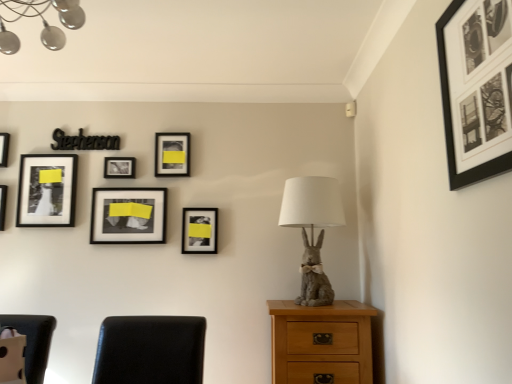
Where is `metallic glass chandelier at upper left`? Image resolution: width=512 pixels, height=384 pixels. metallic glass chandelier at upper left is located at coordinates (42, 22).

Measure the distance between matte black picture frame at upper left, which is the 6th picture frame from front to back, and camera.

matte black picture frame at upper left, which is the 6th picture frame from front to back, and camera are 8.21 feet apart from each other.

I want to click on matte black picture frame at upper left, the fifth picture frame viewed from the right, so click(x=119, y=167).

The height and width of the screenshot is (384, 512). Describe the element at coordinates (321, 342) in the screenshot. I see `light oak wooden chest of drawers at lower right` at that location.

What do you see at coordinates (3, 205) in the screenshot? I see `matte black picture frame at left, which ranks as the 7th picture frame in right-to-left order` at bounding box center [3, 205].

Describe the element at coordinates (475, 91) in the screenshot. I see `black matte picture frame at upper right, the first picture frame from the front` at that location.

Identify the location of metallic glass chandelier at upper left. (x=42, y=22).

Between matte black frame at upper left, which is the 5th picture frame in front-to-back order, and matte black picture frame at upper left, the eighth picture frame from the front, which one has larger width?

matte black frame at upper left, which is the 5th picture frame in front-to-back order, is wider.

From the image's perspective, is matte black frame at upper left, positioned as the fourth picture frame in back-to-front order, positioned above or below matte black picture frame at upper left, marked as the first picture frame in a left-to-right arrangement?

Based on their image positions, matte black frame at upper left, positioned as the fourth picture frame in back-to-front order, is located beneath matte black picture frame at upper left, marked as the first picture frame in a left-to-right arrangement.

From a real-world perspective, is matte black frame at upper left, the sixth picture frame in the right-to-left sequence, located beneath matte black picture frame at upper left, marked as the first picture frame in a left-to-right arrangement?

Yes, from a real-world perspective, matte black frame at upper left, the sixth picture frame in the right-to-left sequence, is under matte black picture frame at upper left, marked as the first picture frame in a left-to-right arrangement.

Is matte black frame at upper left, the 3th picture frame when ordered from left to right, directly adjacent to matte black picture frame at upper left, which appears as the first picture frame when viewed from the back?

They are not placed beside each other.

Is matte black picture frame at center, the sixth picture frame when ordered from back to front, oriented towards black matte picture frame at upper right, which ranks as the first picture frame in right-to-left order?

No.

From the picture: Is there a large distance between matte black picture frame at center, which is counted as the 4th picture frame, starting from the right, and black matte picture frame at upper right, the first picture frame from the front?

Yes, matte black picture frame at center, which is counted as the 4th picture frame, starting from the right, and black matte picture frame at upper right, the first picture frame from the front, are quite far apart.

Is matte black picture frame at center, the sixth picture frame when ordered from back to front, positioned behind black matte picture frame at upper right, the first picture frame from the front?

Yes, the depth of matte black picture frame at center, the sixth picture frame when ordered from back to front, is greater than that of black matte picture frame at upper right, the first picture frame from the front.

There is a light oak wooden chest of drawers at lower right. Where is `the 6th picture frame above it (from a real-world perspective)`? The height and width of the screenshot is (384, 512). the 6th picture frame above it (from a real-world perspective) is located at coordinates [x=119, y=167].

Considering the relative positions of matte black picture frame at upper left, which is counted as the fourth picture frame, starting from the left, and light oak wooden chest of drawers at lower right in the image provided, is matte black picture frame at upper left, which is counted as the fourth picture frame, starting from the left, to the left or to the right of light oak wooden chest of drawers at lower right?

Based on their positions, matte black picture frame at upper left, which is counted as the fourth picture frame, starting from the left, is located to the left of light oak wooden chest of drawers at lower right.

From the image's perspective, which is above, matte black picture frame at upper left, which is the 6th picture frame from front to back, or light oak wooden chest of drawers at lower right?

matte black picture frame at upper left, which is the 6th picture frame from front to back.

Is matte black picture frame at upper center, the second picture frame positioned from the back, not within matte black picture frame at center, the second picture frame viewed from the right?

Yes, matte black picture frame at upper center, the second picture frame positioned from the back, is located beyond the bounds of matte black picture frame at center, the second picture frame viewed from the right.

Considering the points (163, 134) and (200, 251), which point is in front, point (163, 134) or point (200, 251)?

Point (200, 251)

Does matte black picture frame at upper center, the 3th picture frame in the right-to-left sequence, appear on the right side of matte black picture frame at center, the second picture frame in the front-to-back sequence?

No, matte black picture frame at upper center, the 3th picture frame in the right-to-left sequence, is not to the right of matte black picture frame at center, the second picture frame in the front-to-back sequence.

Which is less distant, (367,368) or (327,298)?

Point (367,368).

From the image's perspective, is light oak wooden chest of drawers at lower right over gray fabric rabbit at center?

No.

Is light oak wooden chest of drawers at lower right oriented away from gray fabric rabbit at center?

light oak wooden chest of drawers at lower right is not turned away from gray fabric rabbit at center.

In the scene shown: Which object is positioned more to the right, matte black picture frame at left, the fourth picture frame positioned from the front, or matte black picture frame at center, the second picture frame in the front-to-back sequence?

matte black picture frame at center, the second picture frame in the front-to-back sequence.

Is matte black picture frame at left, which ranks as the 7th picture frame in right-to-left order, not close to matte black picture frame at center, the second picture frame viewed from the right?

matte black picture frame at left, which ranks as the 7th picture frame in right-to-left order, is far away from matte black picture frame at center, the second picture frame viewed from the right.

Do you think matte black picture frame at left, the 2th picture frame from the left, is within matte black picture frame at center, the second picture frame viewed from the right, or outside of it?

matte black picture frame at left, the 2th picture frame from the left, is not enclosed by matte black picture frame at center, the second picture frame viewed from the right.

Which picture frame is the 2nd one when counting from the front of the matte black picture frame at left, the fifth picture frame viewed from the back? Please provide its 2D coordinates.

[(199, 230)]

Considering their positions, is matte black picture frame at upper left, which is the 6th picture frame from front to back, located in front of or behind matte black picture frame at upper center, the 7th picture frame from the front?

matte black picture frame at upper left, which is the 6th picture frame from front to back, is positioned closer to the viewer than matte black picture frame at upper center, the 7th picture frame from the front.

Can you confirm if matte black picture frame at upper left, the third picture frame when ordered from back to front, is bigger than matte black picture frame at upper center, the 3th picture frame in the right-to-left sequence?

Incorrect, matte black picture frame at upper left, the third picture frame when ordered from back to front, is not larger than matte black picture frame at upper center, the 3th picture frame in the right-to-left sequence.

Based on the photo, from the image's perspective, which one is positioned higher, matte black picture frame at upper left, the third picture frame when ordered from back to front, or matte black picture frame at upper center, the 7th picture frame from the front?

matte black picture frame at upper center, the 7th picture frame from the front, appears higher in the image.

From a real-world perspective, starting from the matte black picture frame at upper left, the fifth picture frame viewed from the right, which picture frame is the 1st one vertically above it? Please provide its 2D coordinates.

[(172, 154)]

I want to click on the 2nd picture frame to the left of the matte black frame at upper left, the 3th picture frame when ordered from left to right, counting from the anchor's position, so click(4, 148).

Where is `the 6th picture frame below when counting from the black matte picture frame at upper right, which ranks as the first picture frame in right-to-left order (from the image's perspective)`? This screenshot has width=512, height=384. the 6th picture frame below when counting from the black matte picture frame at upper right, which ranks as the first picture frame in right-to-left order (from the image's perspective) is located at coordinates (128, 216).

Estimate the real-world distances between objects in this image. Which object is closer to light oak wooden chest of drawers at lower right, matte black picture frame at center, which is counted as the 4th picture frame, starting from the right, or matte black picture frame at upper left, which is the 6th picture frame from front to back?

Based on the image, matte black picture frame at center, which is counted as the 4th picture frame, starting from the right, appears to be nearer to light oak wooden chest of drawers at lower right.

Based on their spatial positions, is matte black picture frame at upper center, the second picture frame positioned from the back, or matte black picture frame at left, the fifth picture frame viewed from the back, further from light oak wooden chest of drawers at lower right?

matte black picture frame at left, the fifth picture frame viewed from the back.

When comparing their distances from black matte picture frame at upper right, which ranks as the first picture frame in right-to-left order, does matte black frame at upper left, positioned as the fourth picture frame in back-to-front order, or matte black picture frame at center, the second picture frame viewed from the right, seem further?

matte black frame at upper left, positioned as the fourth picture frame in back-to-front order, lies further to black matte picture frame at upper right, which ranks as the first picture frame in right-to-left order, than the other object.

Looking at the image, which one is located closer to matte black picture frame at upper left, which appears as the first picture frame when viewed from the back, matte black picture frame at upper center, the second picture frame positioned from the back, or black matte picture frame at upper right, acting as the 8th picture frame starting from the left?

matte black picture frame at upper center, the second picture frame positioned from the back, is positioned closer to the anchor matte black picture frame at upper left, which appears as the first picture frame when viewed from the back.

Estimate the real-world distances between objects in this image. Which object is further from matte black picture frame at upper left, which is the 6th picture frame from front to back, gray fabric rabbit at center or matte black picture frame at center, the second picture frame in the front-to-back sequence?

gray fabric rabbit at center lies further to matte black picture frame at upper left, which is the 6th picture frame from front to back, than the other object.

Looking at the image, which one is located further to matte black picture frame at center, which is the third picture frame in front-to-back order, black matte picture frame at upper right, which ranks as the first picture frame in right-to-left order, or matte black picture frame at left, the fourth picture frame positioned from the front?

black matte picture frame at upper right, which ranks as the first picture frame in right-to-left order, is further to matte black picture frame at center, which is the third picture frame in front-to-back order.

When comparing their distances from matte black picture frame at upper left, marked as the first picture frame in a left-to-right arrangement, does metallic glass chandelier at upper left or light oak wooden chest of drawers at lower right seem further?

Based on the image, light oak wooden chest of drawers at lower right appears to be further to matte black picture frame at upper left, marked as the first picture frame in a left-to-right arrangement.

Consider the image. Which object lies further to the anchor point light oak wooden chest of drawers at lower right, matte black picture frame at upper center, the 3th picture frame in the right-to-left sequence, or matte black picture frame at center, the second picture frame in the front-to-back sequence?

matte black picture frame at upper center, the 3th picture frame in the right-to-left sequence.

Find the location of a particular element. This screenshot has height=384, width=512. lamp between matte black picture frame at left, which ranks as the 7th picture frame in right-to-left order, and gray fabric rabbit at center is located at coordinates (42, 22).

This screenshot has height=384, width=512. What are the coordinates of `table lamp positioned between metallic glass chandelier at upper left and matte black picture frame at upper left, the third picture frame when ordered from back to front, from near to far` in the screenshot? It's located at (312, 229).

Where is `table lamp between matte black picture frame at upper center, the 7th picture frame from the front, and light oak wooden chest of drawers at lower right, in the vertical direction`? table lamp between matte black picture frame at upper center, the 7th picture frame from the front, and light oak wooden chest of drawers at lower right, in the vertical direction is located at coordinates (312, 229).

You are a GUI agent. You are given a task and a screenshot of the screen. Output one action in this format:
    pyautogui.click(x=<x>, y=<y>)
    Task: Click on the chest of drawers between black matte picture frame at upper right, acting as the 8th picture frame starting from the left, and gray fabric rabbit at center in the front-back direction
    
    Given the screenshot: What is the action you would take?
    pyautogui.click(x=321, y=342)